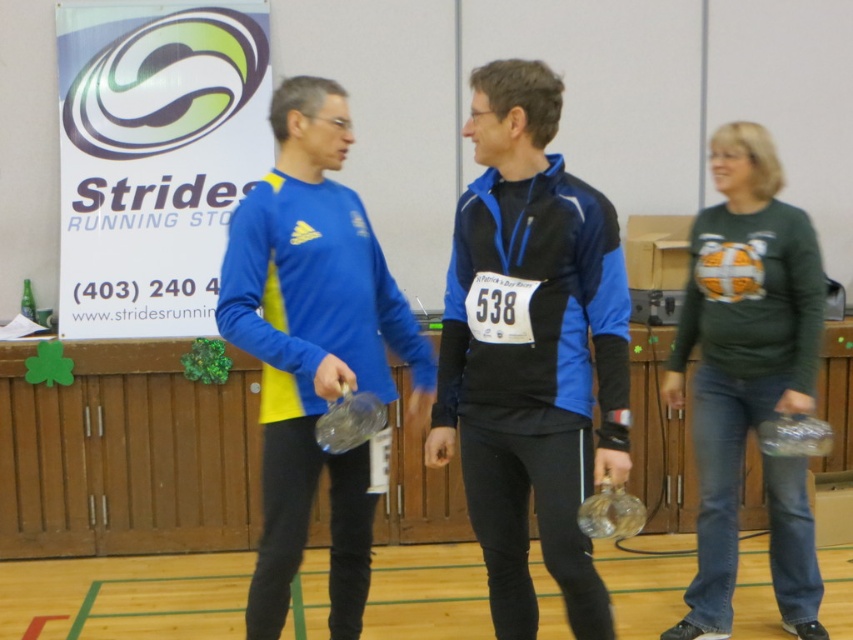
You are standing at the entrance of the gymnasium and see two points marked on the floor. The first point is at coordinate point(x=554, y=458) and the second point is at coordinate point(x=320, y=461). Which point is closer to you?

Point(x=554, y=458) is in front of point(x=320, y=461), so it is closer to you.

You are a photographer standing at the back of the gymnasium. You want to take a photo of both the blue matte jacket at center and the green jersey at right without moving either of them. Can you position yourself in a way that both are fully visible in the frame?

The blue matte jacket at center is 92.75 centimeters away from the green jersey at right. Since the distance between them is less than the typical camera frame width, you can position yourself so that both are fully visible in the frame.